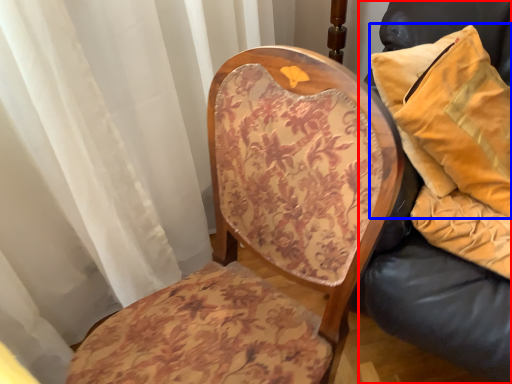
Question: Among these objects, which one is nearest to the camera, furniture (highlighted by a red box) or pillow (highlighted by a blue box)?

Choices:
 (A) furniture
 (B) pillow

Answer: (A)